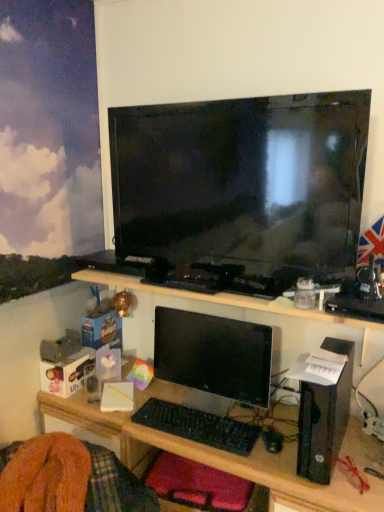
Question: Can you confirm if black plastic computer at right is positioned to the right of velvet-like red cushion at lower center?

Choices:
 (A) no
 (B) yes

Answer: (B)

Question: Is black plastic computer at right oriented towards velvet-like red cushion at lower center?

Choices:
 (A) yes
 (B) no

Answer: (B)

Question: Is black plastic computer at right located outside velvet-like red cushion at lower center?

Choices:
 (A) no
 (B) yes

Answer: (B)

Question: From the image's perspective, does black plastic computer at right appear lower than velvet-like red cushion at lower center?

Choices:
 (A) yes
 (B) no

Answer: (B)

Question: Is black plastic computer at right bigger than velvet-like red cushion at lower center?

Choices:
 (A) yes
 (B) no

Answer: (B)

Question: Is black plastic computer at right thinner than velvet-like red cushion at lower center?

Choices:
 (A) no
 (B) yes

Answer: (A)

Question: Considering the relative sizes of black glossy monitor at center and black glossy tv at upper center in the image provided, is black glossy monitor at center smaller than black glossy tv at upper center?

Choices:
 (A) yes
 (B) no

Answer: (A)

Question: Is black glossy monitor at center turned away from black glossy tv at upper center?

Choices:
 (A) no
 (B) yes

Answer: (A)

Question: From the image's perspective, would you say black glossy monitor at center is shown under black glossy tv at upper center?

Choices:
 (A) no
 (B) yes

Answer: (B)

Question: Is black glossy monitor at center thinner than black glossy tv at upper center?

Choices:
 (A) no
 (B) yes

Answer: (B)

Question: Is black glossy monitor at center surrounding black glossy tv at upper center?

Choices:
 (A) no
 (B) yes

Answer: (A)

Question: From a real-world perspective, is black glossy monitor at center on black glossy tv at upper center?

Choices:
 (A) no
 (B) yes

Answer: (A)

Question: Is black plastic keyboard at center in front of black glossy monitor at center?

Choices:
 (A) yes
 (B) no

Answer: (A)